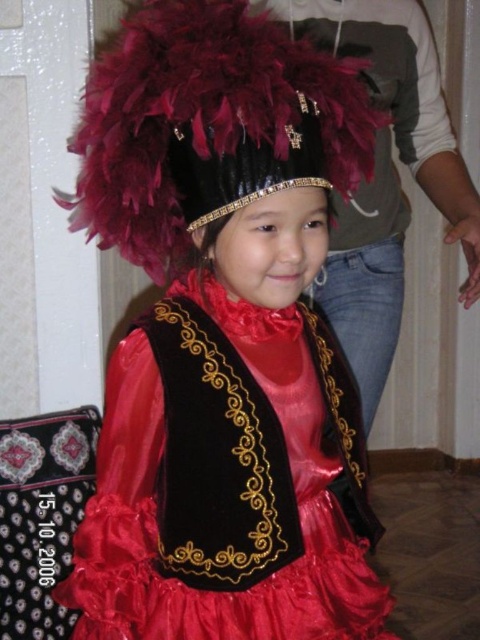
Question: Can you confirm if velvet satin dress at center is positioned to the right of feathered black headdress at upper center?

Choices:
 (A) no
 (B) yes

Answer: (B)

Question: Which of the following is the farthest from the observer?

Choices:
 (A) (179, 240)
 (B) (363, 636)

Answer: (B)

Question: Is velvet satin dress at center above feathered black headdress at upper center?

Choices:
 (A) yes
 (B) no

Answer: (B)

Question: From the image, what is the correct spatial relationship of velvet satin dress at center in relation to feathered black headdress at upper center?

Choices:
 (A) below
 (B) above

Answer: (A)

Question: Which point is closer to the camera taking this photo?

Choices:
 (A) (297, 499)
 (B) (229, 81)

Answer: (B)